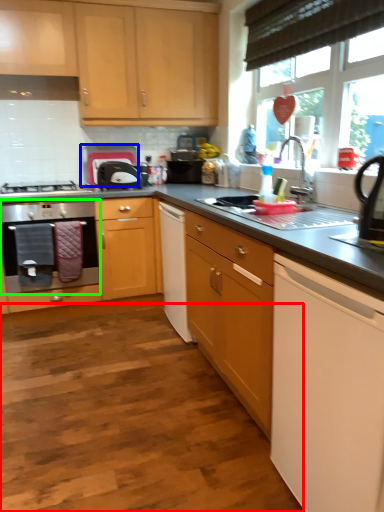
Question: Which object is the farthest from plain (highlighted by a red box)? Choose among these: appliance (highlighted by a blue box) or home appliance (highlighted by a green box).

Choices:
 (A) appliance
 (B) home appliance

Answer: (A)